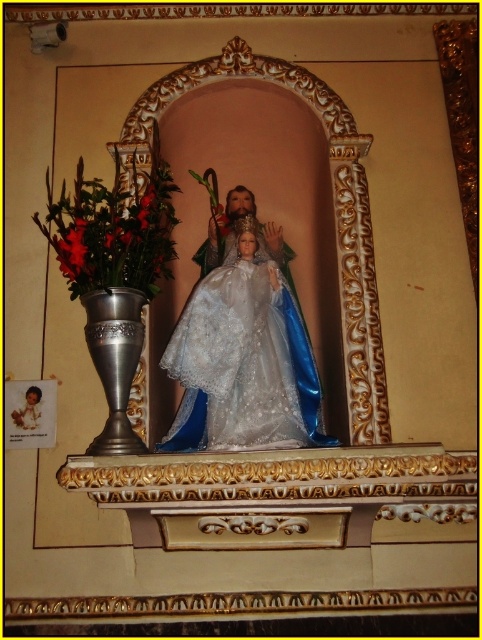
You are standing in front of the religious altar and want to place a small candle. There are two points marked on the altar where you can place it. The first point is at coordinates point [286,444], and the second point is at coordinates point [101,256]. Which point is closer to you where you can place the candle?

Point [286,444] is closer to the viewer than point [101,256], so you should place the candle at point [286,444].

You are an altar caretaker who needs to move the metallic vase at left closer to the satin white gown at center. The minimum safe distance required between them is 6 feet to avoid damage. Is the current distance sufficient?

The distance between the satin white gown at center and metallic vase at left is 7.94 feet, which is greater than the minimum required 6 feet. Therefore, the current distance is sufficient and no adjustment is needed.